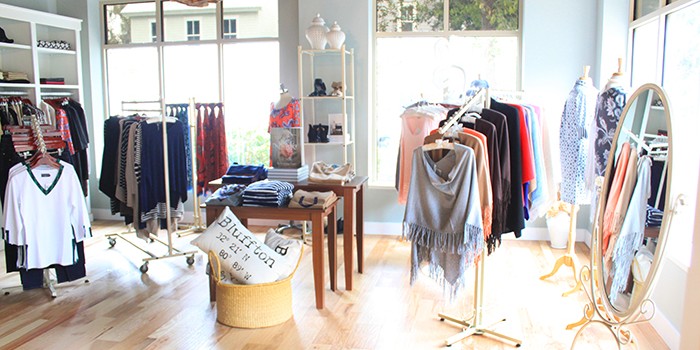
Locate an element on the screen. This screenshot has height=350, width=700. large basket on floor is located at coordinates (251, 301).